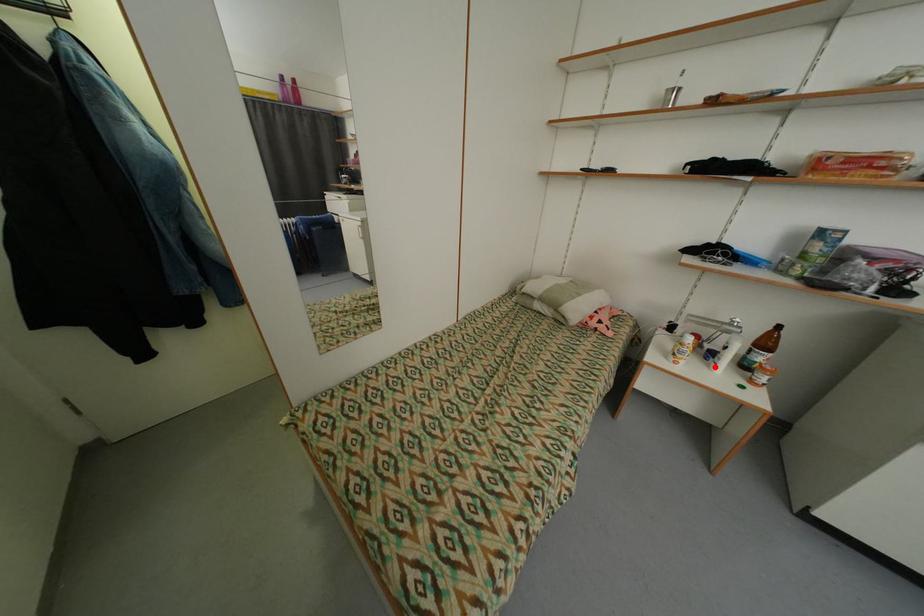
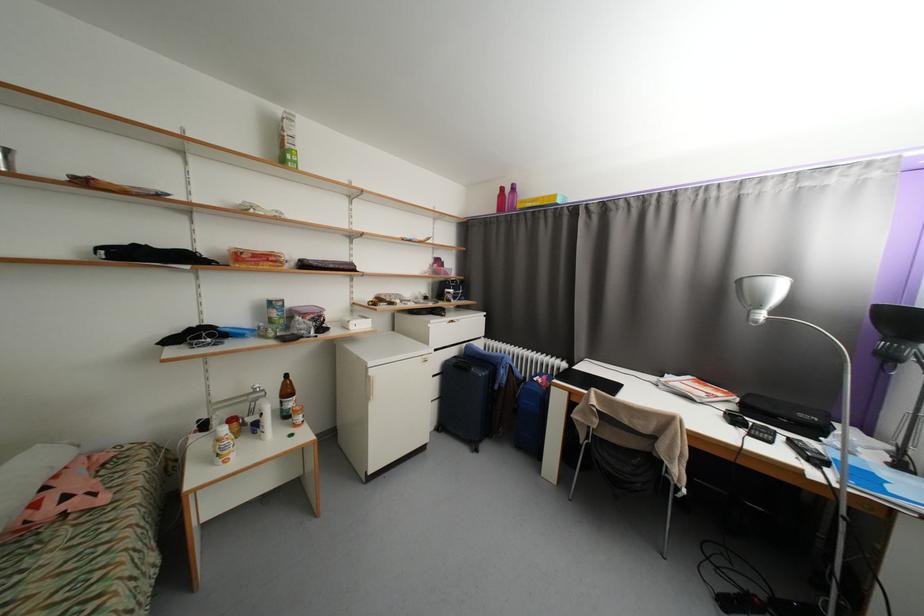
The point at the highlighted location is marked in the first image. Where is the corresponding point in the second image?

(265, 439)